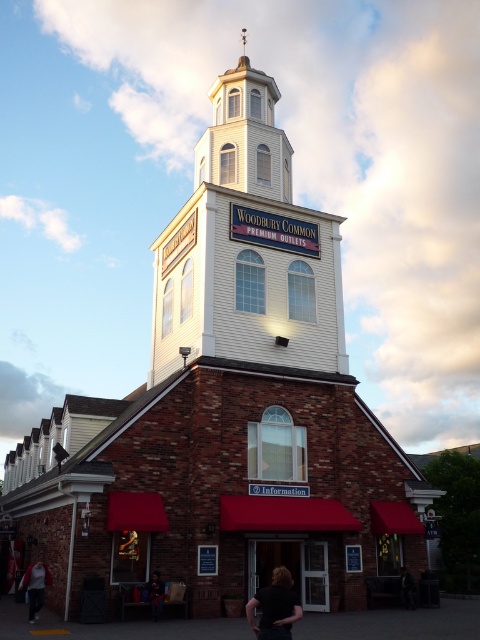
Question: Can you confirm if white wood bell tower at upper center is positioned to the left of dark brown leather jacket at lower center?

Choices:
 (A) yes
 (B) no

Answer: (A)

Question: Does black matte shirt at lower center lie in front of dark brown leather jacket at lower center?

Choices:
 (A) yes
 (B) no

Answer: (A)

Question: Does white wood bell tower at upper center have a larger size compared to dark gray hoodie at lower left?

Choices:
 (A) no
 (B) yes

Answer: (B)

Question: Which point is closer to the camera?

Choices:
 (A) (24, 577)
 (B) (222, 349)

Answer: (A)

Question: Which is nearer to the black matte shirt at lower center?

Choices:
 (A) white wooden clock tower at upper center
 (B) white wood bell tower at upper center
 (C) dark hair at lower center

Answer: (C)

Question: Based on their relative distances, which object is nearer to the dark hair at lower center?

Choices:
 (A) dark brown leather jacket at lower center
 (B) white wood bell tower at upper center
 (C) dark gray hoodie at lower left

Answer: (C)